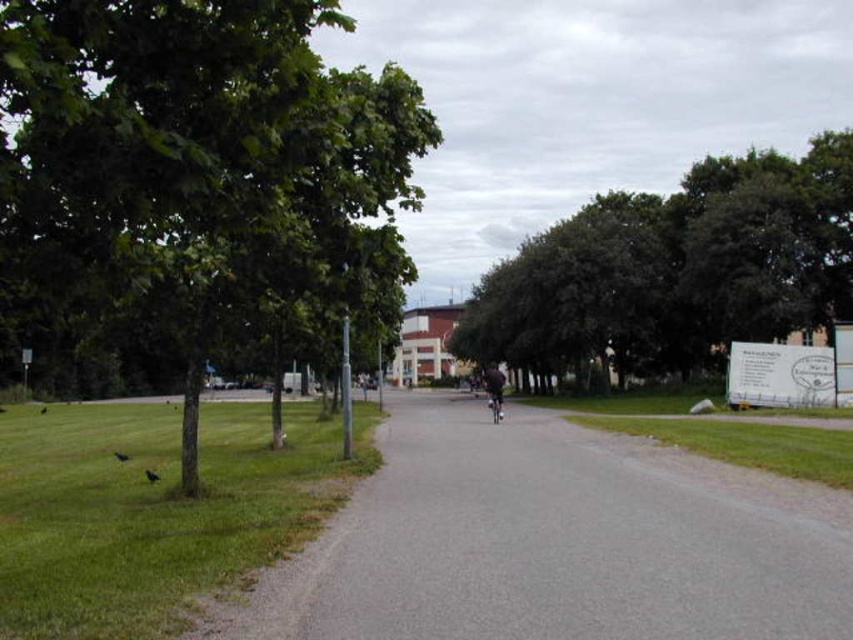
Question: Which point is farther from the camera taking this photo?

Choices:
 (A) (532, 368)
 (B) (492, 420)
 (C) (238, 198)
 (D) (173, 552)

Answer: (A)

Question: Is green leafy tree at center behind dark fabric bicycle at center?

Choices:
 (A) yes
 (B) no

Answer: (A)

Question: Which object is positioned closest to the dark fabric bicycle at center?

Choices:
 (A) shiny metallic bicycle at center
 (B) green grass at lower left

Answer: (A)

Question: Does dark fabric bicycle at center appear under shiny metallic bicycle at center?

Choices:
 (A) no
 (B) yes

Answer: (A)

Question: Does green grass at lower left come behind shiny metallic bicycle at center?

Choices:
 (A) no
 (B) yes

Answer: (A)

Question: Which object is closer to the camera taking this photo?

Choices:
 (A) green leafy tree at center
 (B) shiny metallic bicycle at center
 (C) green leafy tree at left
 (D) green grass at lower left

Answer: (C)